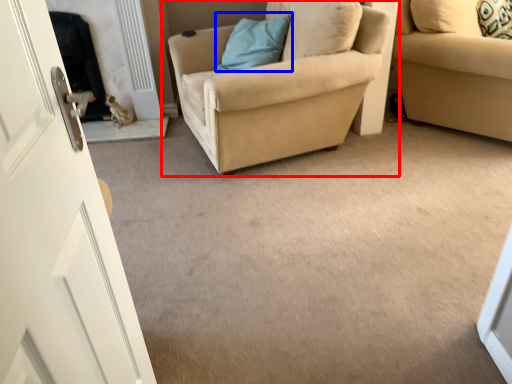
Question: Among these objects, which one is farthest to the camera, chair (highlighted by a red box) or pillow (highlighted by a blue box)?

Choices:
 (A) chair
 (B) pillow

Answer: (B)